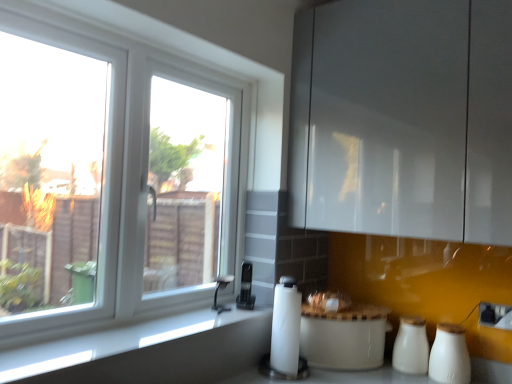
This screenshot has height=384, width=512. Identify the location of vacant space situated above smooth gray countertop at lower left (from a real-world perspective). click(x=137, y=331).